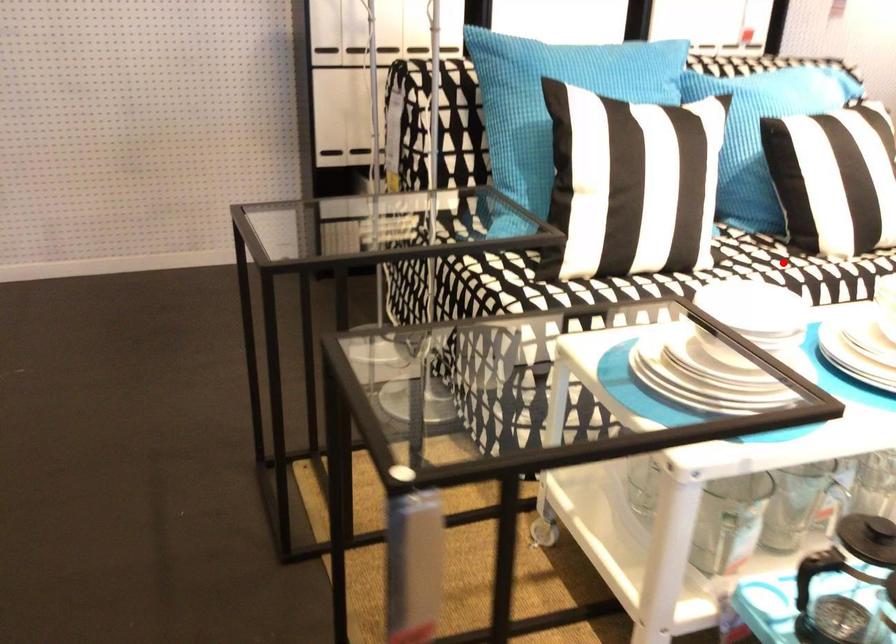
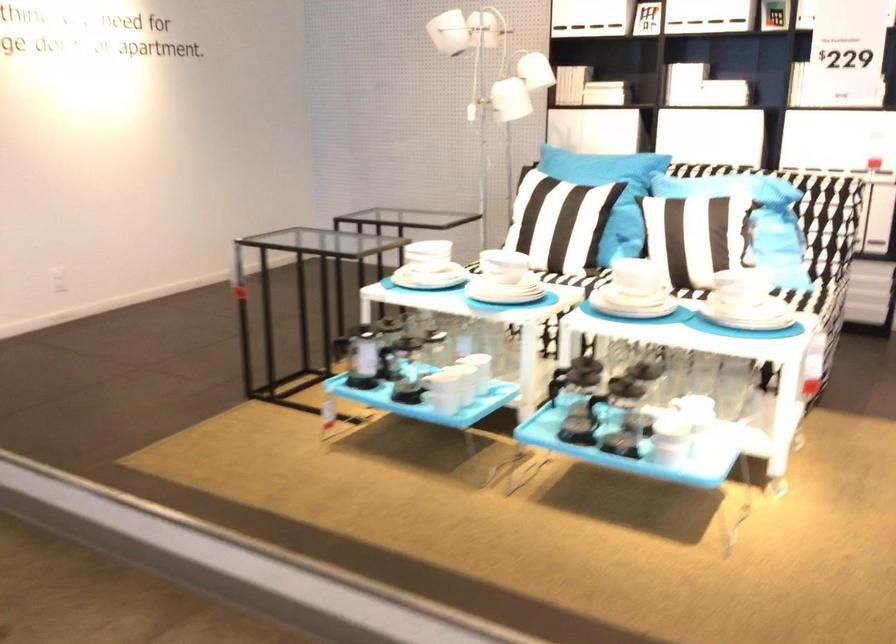
Question: I am providing you with two images of the same scene from different viewpoints. A red point is marked on the first image. Can you still see the location of the red point in image 2?

Choices:
 (A) Yes
 (B) No

Answer: (B)